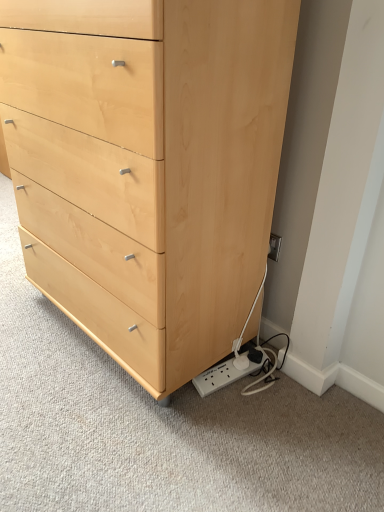
Question: From a real-world perspective, is natural wood chest of drawers at lower left above or below white plastic power strip at lower right?

Choices:
 (A) below
 (B) above

Answer: (B)

Question: Relative to white plastic power strip at lower right, is natural wood chest of drawers at lower left in front or behind?

Choices:
 (A) front
 (B) behind

Answer: (A)

Question: From the image's perspective, is natural wood chest of drawers at lower left positioned above or below white plastic power strip at lower right?

Choices:
 (A) below
 (B) above

Answer: (B)

Question: Considering the relative positions of white plastic power strip at lower right and natural wood chest of drawers at lower left in the image provided, is white plastic power strip at lower right to the left or to the right of natural wood chest of drawers at lower left?

Choices:
 (A) right
 (B) left

Answer: (A)

Question: From a real-world perspective, is white plastic power strip at lower right above or below natural wood chest of drawers at lower left?

Choices:
 (A) above
 (B) below

Answer: (B)

Question: Considering their positions, is white plastic power strip at lower right located in front of or behind natural wood chest of drawers at lower left?

Choices:
 (A) front
 (B) behind

Answer: (B)

Question: From the image's perspective, is white plastic power strip at lower right located above or below natural wood chest of drawers at lower left?

Choices:
 (A) above
 (B) below

Answer: (B)